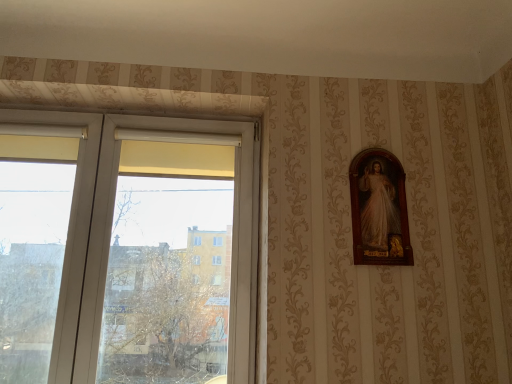
Question: Is transparent glass window at left inside or outside of wooden frame at right?

Choices:
 (A) outside
 (B) inside

Answer: (A)

Question: Considering the positions of point (99, 210) and point (375, 213), is point (99, 210) closer or farther from the camera than point (375, 213)?

Choices:
 (A) closer
 (B) farther

Answer: (B)

Question: From the image's perspective, is transparent glass window at left located above or below wooden frame at right?

Choices:
 (A) above
 (B) below

Answer: (B)

Question: Considering their positions, is wooden frame at right located in front of or behind transparent glass window at left?

Choices:
 (A) front
 (B) behind

Answer: (B)

Question: Based on their sizes in the image, would you say wooden frame at right is bigger or smaller than transparent glass window at left?

Choices:
 (A) big
 (B) small

Answer: (B)

Question: Considering the positions of point (408, 243) and point (73, 112), is point (408, 243) closer or farther from the camera than point (73, 112)?

Choices:
 (A) farther
 (B) closer

Answer: (B)

Question: From a real-world perspective, relative to transparent glass window at left, is wooden frame at right vertically above or below?

Choices:
 (A) below
 (B) above

Answer: (B)